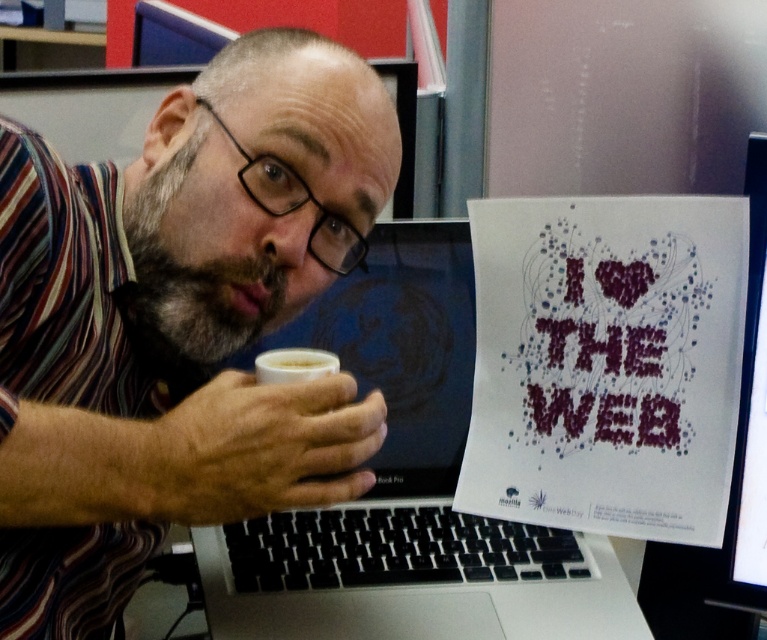
Based on the photo, can you confirm if silver/black laptop at center is wider than white frothy foam at upper center?

Yes.

Who is positioned more to the right, silver/black laptop at center or white frothy foam at upper center?

silver/black laptop at center is more to the right.

You are a GUI agent. You are given a task and a screenshot of the screen. Output one action in this format:
    pyautogui.click(x=<x>, y=<y>)
    Task: Click on the silver/black laptop at center
    The image size is (767, 640).
    Given the screenshot: What is the action you would take?
    pyautogui.click(x=407, y=488)

Is silver/black laptop at center below white frothy beverage at lower center?

Indeed, silver/black laptop at center is positioned under white frothy beverage at lower center.

Does silver/black laptop at center have a greater width compared to white frothy beverage at lower center?

Yes, silver/black laptop at center is wider than white frothy beverage at lower center.

Who is more forward, (x=446, y=228) or (x=290, y=360)?

Point (x=290, y=360) is more forward.

This screenshot has height=640, width=767. I want to click on silver/black laptop at center, so click(407, 488).

Between point (295, 216) and point (555, 316), which one is positioned in front?

Point (295, 216) is more forward.

Is striped fabric shirt at center shorter than white paper poster at center?

No, striped fabric shirt at center is not shorter than white paper poster at center.

Locate an element on the screen. Image resolution: width=767 pixels, height=640 pixels. striped fabric shirt at center is located at coordinates (178, 321).